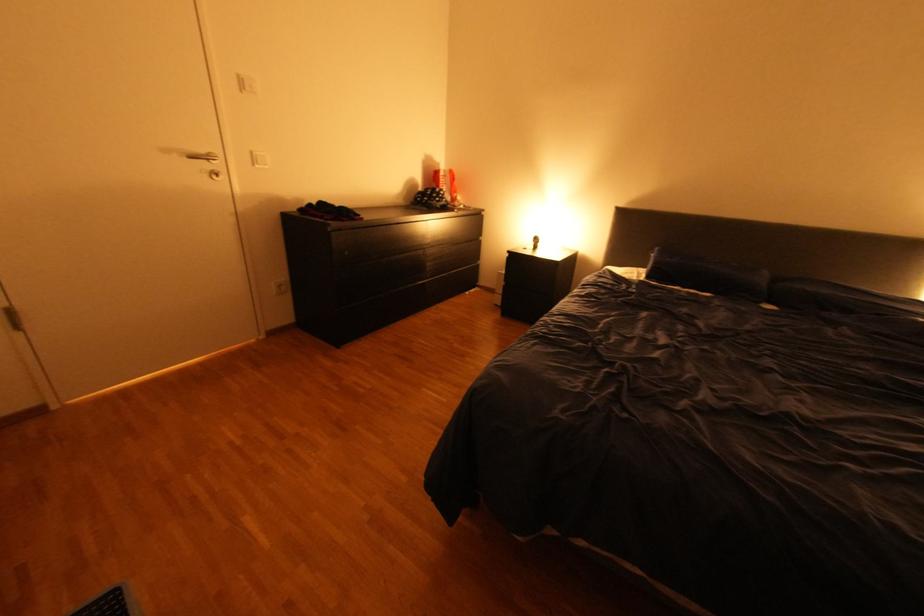
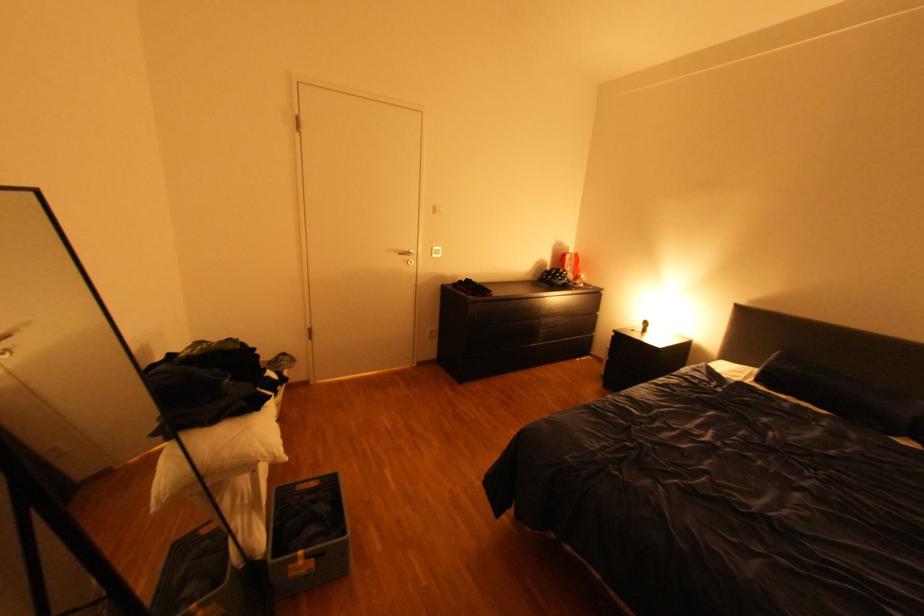
Where in the second image is the point corresponding to (x=176, y=150) from the first image?

(399, 249)